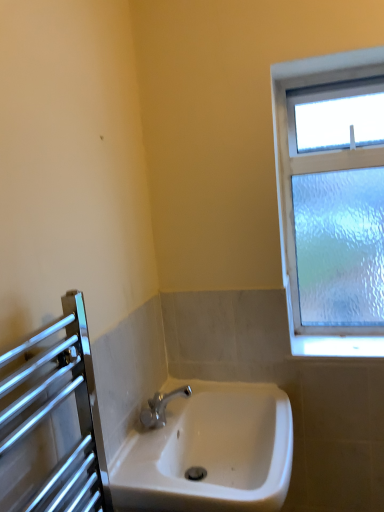
Question: Is white ceramic sink at center facing away from clear glass window at upper right?

Choices:
 (A) no
 (B) yes

Answer: (A)

Question: From a real-world perspective, is white ceramic sink at center physically below clear glass window at upper right?

Choices:
 (A) no
 (B) yes

Answer: (B)

Question: Is white ceramic sink at center facing towards clear glass window at upper right?

Choices:
 (A) no
 (B) yes

Answer: (A)

Question: Is white ceramic sink at center at the left side of clear glass window at upper right?

Choices:
 (A) no
 (B) yes

Answer: (B)

Question: Is clear glass window at upper right a part of white ceramic sink at center?

Choices:
 (A) yes
 (B) no

Answer: (B)

Question: Does white ceramic sink at center have a greater height compared to clear glass window at upper right?

Choices:
 (A) no
 (B) yes

Answer: (A)

Question: From the image's perspective, is clear glass window at upper right above white ceramic sink at center?

Choices:
 (A) yes
 (B) no

Answer: (A)

Question: Is there a large distance between clear glass window at upper right and white ceramic sink at center?

Choices:
 (A) no
 (B) yes

Answer: (A)

Question: Is white ceramic sink at center surrounded by clear glass window at upper right?

Choices:
 (A) yes
 (B) no

Answer: (B)

Question: From a real-world perspective, is clear glass window at upper right physically above white ceramic sink at center?

Choices:
 (A) no
 (B) yes

Answer: (B)

Question: Does clear glass window at upper right appear on the right side of white ceramic sink at center?

Choices:
 (A) no
 (B) yes

Answer: (B)

Question: Is clear glass window at upper right closer to the viewer compared to white ceramic sink at center?

Choices:
 (A) no
 (B) yes

Answer: (A)

Question: From the image's perspective, relative to clear glass window at upper right, is white ceramic sink at center above or below?

Choices:
 (A) below
 (B) above

Answer: (A)